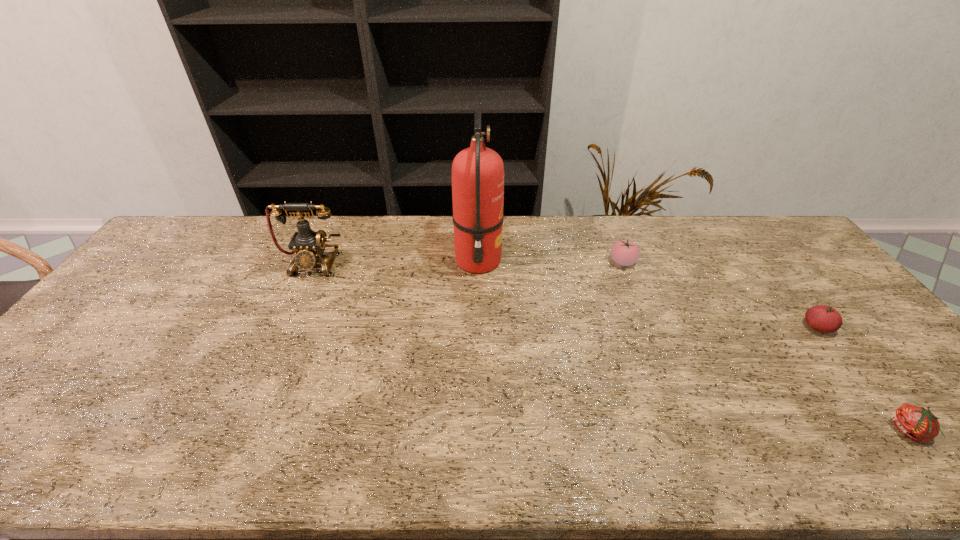
Image resolution: width=960 pixels, height=540 pixels. I want to click on vacant area at the near edge, so click(743, 433).

Find the location of a particular element. The image size is (960, 540). vacant space at the left edge of the desktop is located at coordinates (122, 292).

This screenshot has height=540, width=960. In order to click on vacant space at the far left corner of the desktop in this screenshot , I will do `click(161, 249)`.

Locate an element on the screen. free space between the shortest tomato and the tallest object is located at coordinates (694, 346).

Locate an element on the screen. The width and height of the screenshot is (960, 540). free point between the nearest tomato and the leftmost tomato is located at coordinates (766, 347).

This screenshot has width=960, height=540. I want to click on free space between the shortest tomato and the leftmost tomato, so click(x=766, y=347).

Find the location of a particular element. free space between the leftmost object and the nearest object is located at coordinates (612, 347).

You are a GUI agent. You are given a task and a screenshot of the screen. Output one action in this format:
    pyautogui.click(x=<x>, y=<y>)
    Task: Click on the empty space that is in between the leftmost tomato and the shortest tomato
    
    Given the screenshot: What is the action you would take?
    pyautogui.click(x=766, y=347)

Locate an element on the screen. The width and height of the screenshot is (960, 540). vacant space that is in between the leftmost object and the second farthest tomato is located at coordinates (565, 295).

The height and width of the screenshot is (540, 960). What are the coordinates of `free area in between the tallest object and the telephone` in the screenshot? It's located at (396, 262).